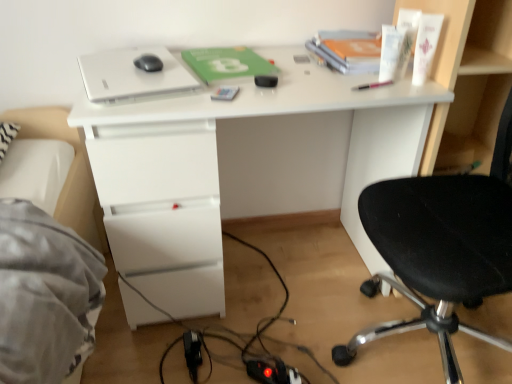
Question: Is black matte mouse at upper center at the right side of pink plastic pen at upper right, which is the second stationery from left to right?

Choices:
 (A) no
 (B) yes

Answer: (A)

Question: Does black matte mouse at upper center have a greater height compared to pink plastic pen at upper right, which is the second stationery from left to right?

Choices:
 (A) no
 (B) yes

Answer: (B)

Question: Is the depth of black matte mouse at upper center less than that of pink plastic pen at upper right, which is the second stationery from left to right?

Choices:
 (A) yes
 (B) no

Answer: (B)

Question: From a real-world perspective, is black matte mouse at upper center positioned under pink plastic pen at upper right, which is the second stationery from left to right, based on gravity?

Choices:
 (A) yes
 (B) no

Answer: (B)

Question: Considering the relative sizes of black matte mouse at upper center and pink plastic pen at upper right, which is the second stationery from left to right, in the image provided, is black matte mouse at upper center smaller than pink plastic pen at upper right, which is the second stationery from left to right,?

Choices:
 (A) yes
 (B) no

Answer: (B)

Question: Does black matte mouse at upper center appear on the left side of pink plastic pen at upper right, positioned as the 1th stationery in right-to-left order?

Choices:
 (A) yes
 (B) no

Answer: (A)

Question: Does white matte laptop at upper center have a greater width compared to metallic silver phone at center, positioned as the 2th stationery in right-to-left order?

Choices:
 (A) no
 (B) yes

Answer: (B)

Question: Is white matte laptop at upper center aimed at metallic silver phone at center, the first stationery from the left?

Choices:
 (A) yes
 (B) no

Answer: (B)

Question: Can you confirm if white matte laptop at upper center is thinner than metallic silver phone at center, the first stationery from the left?

Choices:
 (A) no
 (B) yes

Answer: (A)

Question: Does white matte laptop at upper center have a larger size compared to metallic silver phone at center, the first stationery from the left?

Choices:
 (A) no
 (B) yes

Answer: (B)

Question: Is white matte laptop at upper center to the left of metallic silver phone at center, positioned as the 2th stationery in right-to-left order, from the viewer's perspective?

Choices:
 (A) no
 (B) yes

Answer: (B)

Question: Can you see white matte laptop at upper center touching metallic silver phone at center, positioned as the 2th stationery in right-to-left order?

Choices:
 (A) no
 (B) yes

Answer: (A)

Question: From the image's perspective, is black fabric chair at right located above metallic silver phone at center, positioned as the 2th stationery in right-to-left order?

Choices:
 (A) yes
 (B) no

Answer: (B)